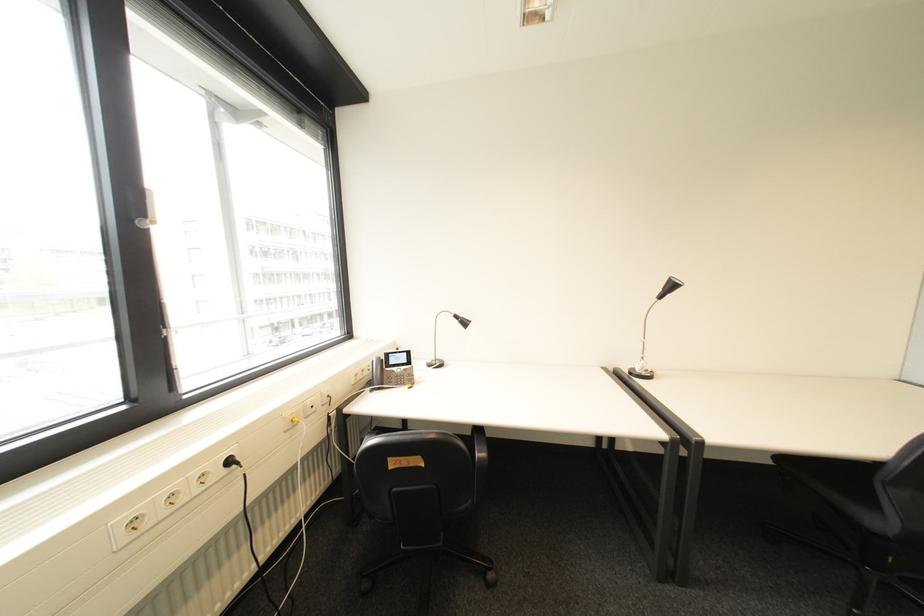
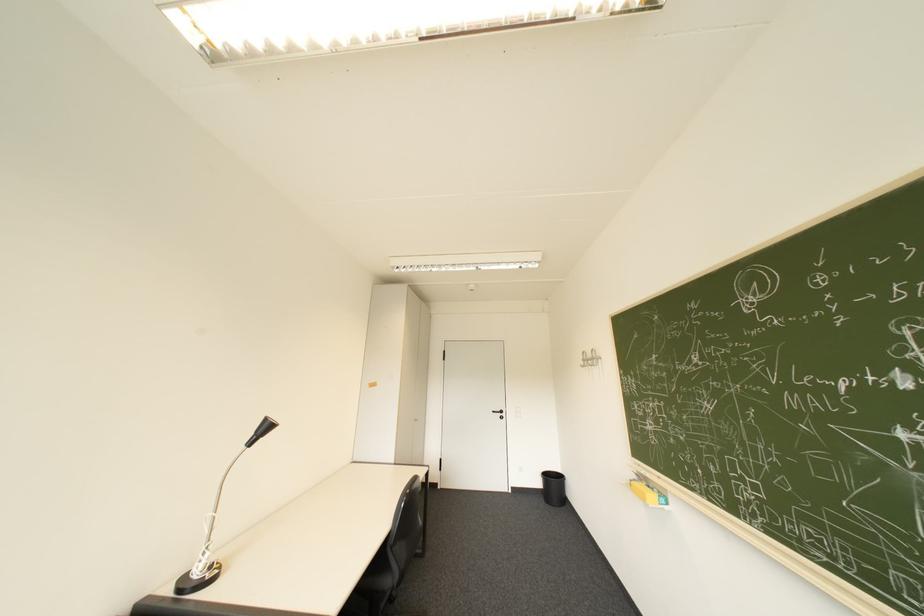
The first image is from the beginning of the video and the second image is from the end. How did the camera likely rotate when shooting the video?

The rotation direction of the camera is right-up.